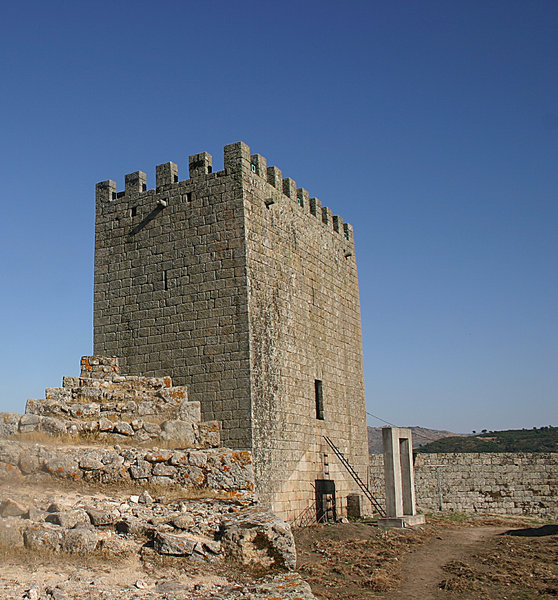
The width and height of the screenshot is (558, 600). I want to click on wall, so click(466, 481), click(294, 328), click(210, 316).